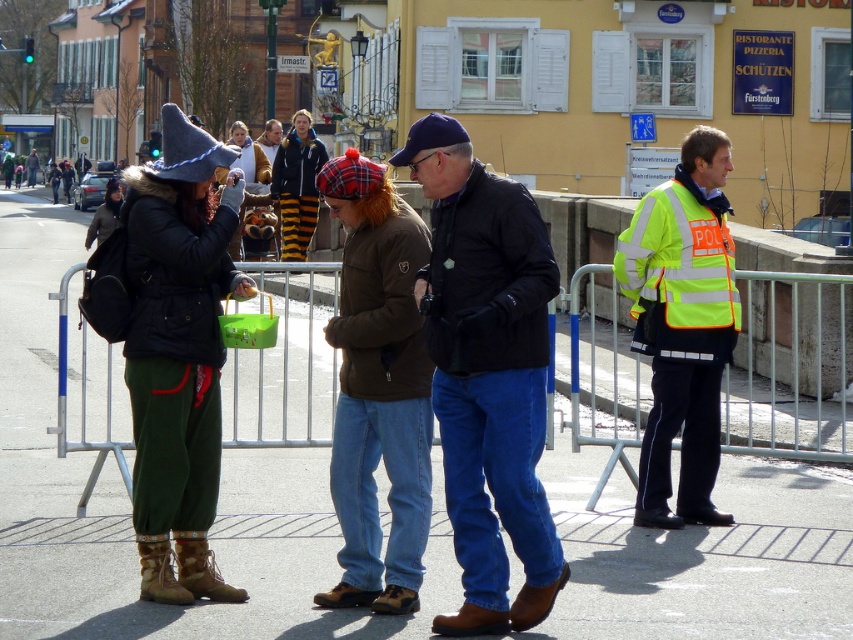
Between matte black jacket at left and brown leather jacket at center, which one is positioned higher?

Positioned higher is matte black jacket at left.

Is matte black jacket at left smaller than brown leather jacket at center?

Yes.

Between point (178, 532) and point (407, 344), which one is positioned behind?

The point (178, 532) is behind.

Image resolution: width=853 pixels, height=640 pixels. Identify the location of matte black jacket at left. (178, 353).

Can you confirm if dark blue denim jeans at center is shorter than brown leather jacket at center?

No, dark blue denim jeans at center is not shorter than brown leather jacket at center.

Is point (506, 444) closer to viewer compared to point (395, 449)?

Yes, point (506, 444) is closer to viewer.

You are a GUI agent. You are given a task and a screenshot of the screen. Output one action in this format:
    pyautogui.click(x=<x>, y=<y>)
    Task: Click on the dark blue denim jeans at center
    The height and width of the screenshot is (640, 853).
    Given the screenshot: What is the action you would take?
    pyautogui.click(x=486, y=374)

Which is below, brown leather jacket at center or high-visibility reflective vest at right?

Positioned lower is brown leather jacket at center.

Locate an element on the screen. brown leather jacket at center is located at coordinates (378, 388).

Where is `brown leather jacket at center`? The image size is (853, 640). brown leather jacket at center is located at coordinates (378, 388).